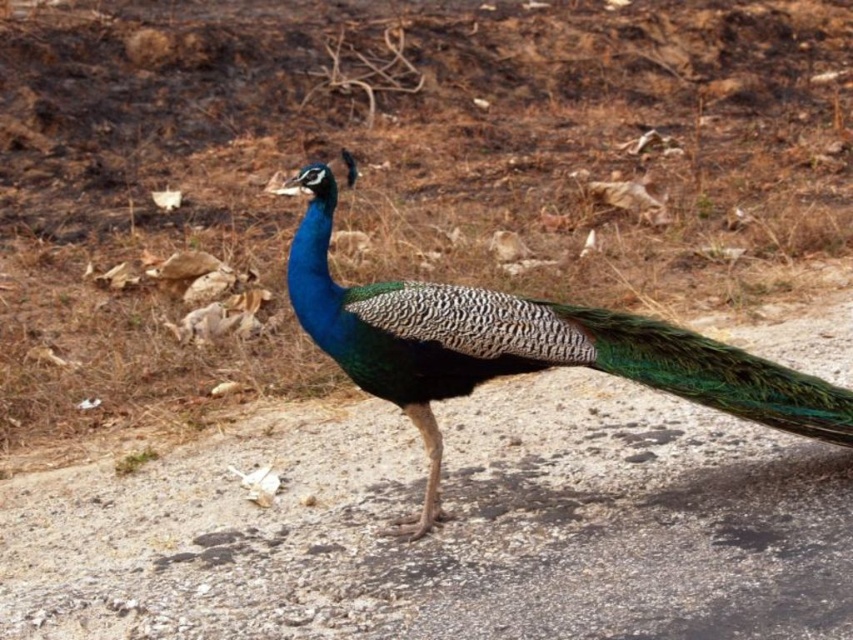
You are a photographer trying to capture the peacock in the image. You need to position your camera at point A, which is located at coordinates (x=520, y=348). Can you confirm if the shiny blue peacock at center is exactly at point A?

Yes, the shiny blue peacock at center is exactly located at point A, which has coordinates (x=520, y=348).

Based on the photo, you are a photographer trying to capture the shiny blue peacock at center and the green iridescent feathers at center in a single frame. Which object should you focus on first to ensure both are in the frame?

The shiny blue peacock at center is bigger than the green iridescent feathers at center, so you should focus on the shiny blue peacock at center first to ensure both are in the frame.

You are standing in front of the peacock and want to place a small decoration between the two points, point (503, 301) and point (793, 380). Which point is closer to you where you should start placing the decoration?

Point (503, 301) is closer to you than point (793, 380), so you should start placing the decoration near point (503, 301).